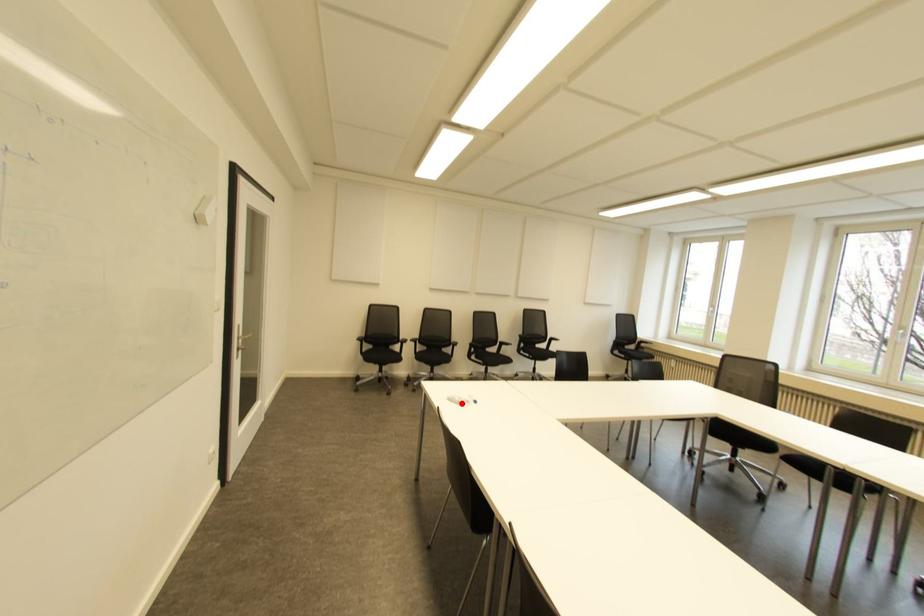
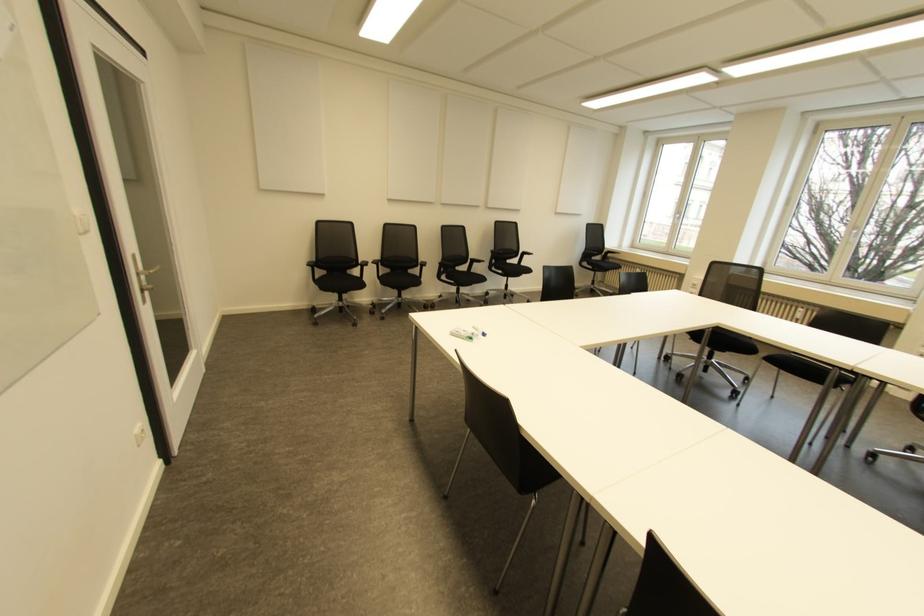
In the second image, find the point that corresponds to the highlighted location in the first image.

(470, 338)